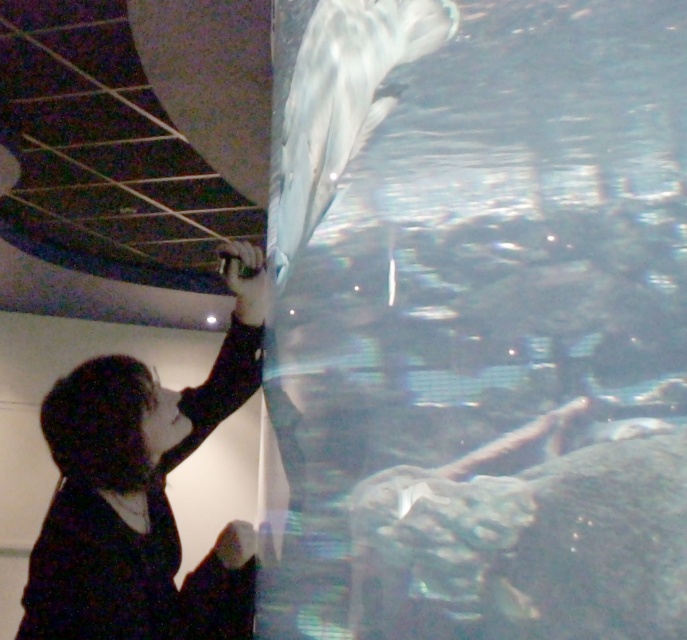
Question: Can you confirm if black matte jacket at lower left is positioned to the left of white glossy dolphin at upper center?

Choices:
 (A) yes
 (B) no

Answer: (A)

Question: Considering the relative positions of black matte jacket at lower left and white glossy dolphin at upper center in the image provided, where is black matte jacket at lower left located with respect to white glossy dolphin at upper center?

Choices:
 (A) left
 (B) right

Answer: (A)

Question: Is black matte jacket at lower left above white glossy dolphin at upper center?

Choices:
 (A) no
 (B) yes

Answer: (A)

Question: Among these points, which one is nearest to the camera?

Choices:
 (A) pos(60,468)
 (B) pos(317,131)

Answer: (B)

Question: Which of the following is the closest to the observer?

Choices:
 (A) click(300, 20)
 (B) click(87, 396)

Answer: (A)

Question: Which of the following is the closest to the observer?

Choices:
 (A) (78, 634)
 (B) (319, 152)

Answer: (B)